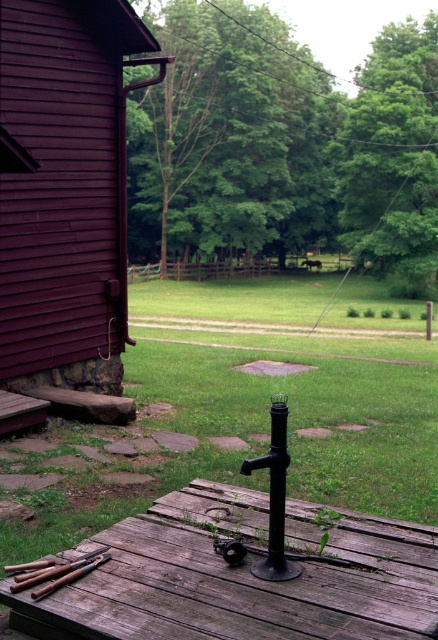
Which is above, rustic wood deck at center or wooden handles at lower left?

wooden handles at lower left is above.

Which is more to the left, rustic wood deck at center or wooden handles at lower left?

Positioned to the left is wooden handles at lower left.

Does point (394, 604) come in front of point (60, 576)?

Yes, point (394, 604) is closer to viewer.

The image size is (438, 640). What are the coordinates of `rustic wood deck at center` in the screenshot? It's located at (243, 576).

Which is more to the left, black matte pole at center or wooden handles at lower left?

From the viewer's perspective, wooden handles at lower left appears more on the left side.

Can you confirm if black matte pole at center is positioned above wooden handles at lower left?

Yes, black matte pole at center is above wooden handles at lower left.

Is point (271, 432) closer to viewer compared to point (73, 564)?

No.

Find the location of a particular element. black matte pole at center is located at coordinates (275, 496).

Identify the location of matte purple siding at left. Image resolution: width=438 pixels, height=640 pixels. (64, 205).

Who is more forward, (88, 285) or (70, 561)?

Point (70, 561) is in front.

Identify the location of matte purple siding at left. (64, 205).